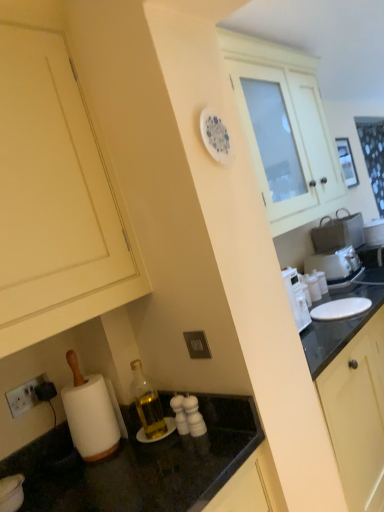
Question: Considering their positions, is white glossy cabinet at upper center, positioned as the second cabinetry in left-to-right order, located in front of or behind white plastic toaster at right?

Choices:
 (A) front
 (B) behind

Answer: (A)

Question: Visually, is white glossy cabinet at upper center, positioned as the second cabinetry in left-to-right order, positioned to the left or to the right of white plastic toaster at right?

Choices:
 (A) left
 (B) right

Answer: (A)

Question: Which object is the farthest from the white plastic toaster at right?

Choices:
 (A) matte cream cabinet at lower left, which is the second cabinetry from right to left
 (B) white glossy cabinet at upper center, which appears as the 1th cabinetry when viewed from the back

Answer: (A)

Question: Which is farther from the white glossy cabinet at upper center, positioned as the second cabinetry in left-to-right order?

Choices:
 (A) white plastic toaster at right
 (B) matte cream cabinet at lower left, placed as the first cabinetry when sorted from left to right

Answer: (B)